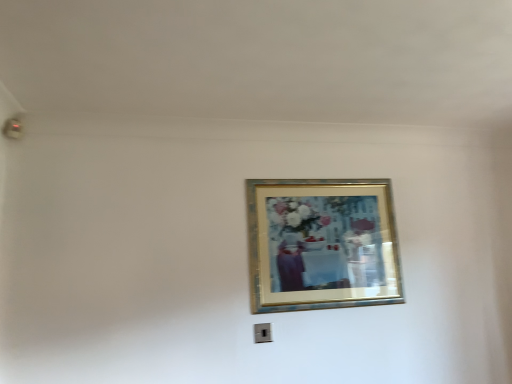
Find the location of a particular element. The height and width of the screenshot is (384, 512). black plastic electric outlet at lower center is located at coordinates click(262, 333).

In order to face black plastic electric outlet at lower center, should I rotate leftwards or rightwards?

To face it directly, rotate right by 1.275 degrees.

What do you see at coordinates (262, 333) in the screenshot? The width and height of the screenshot is (512, 384). I see `black plastic electric outlet at lower center` at bounding box center [262, 333].

Locate an element on the screen. The image size is (512, 384). gold metallic picture frame at upper center is located at coordinates (322, 244).

The width and height of the screenshot is (512, 384). What do you see at coordinates (322, 244) in the screenshot? I see `gold metallic picture frame at upper center` at bounding box center [322, 244].

Find the location of a particular element. black plastic electric outlet at lower center is located at coordinates (262, 333).

Considering the positions of objects gold metallic picture frame at upper center and black plastic electric outlet at lower center in the image provided, who is more to the right, gold metallic picture frame at upper center or black plastic electric outlet at lower center?

From the viewer's perspective, gold metallic picture frame at upper center appears more on the right side.

Does gold metallic picture frame at upper center lie behind black plastic electric outlet at lower center?

No.

Between point (384, 301) and point (269, 325), which one is positioned in front?

The point (269, 325) is closer.

From the image's perspective, which is below, gold metallic picture frame at upper center or black plastic electric outlet at lower center?

black plastic electric outlet at lower center, from the image's perspective.

Consider the image. From a real-world perspective, is gold metallic picture frame at upper center below black plastic electric outlet at lower center?

Actually, gold metallic picture frame at upper center is physically above black plastic electric outlet at lower center in the real world.

Does gold metallic picture frame at upper center have a lesser width compared to black plastic electric outlet at lower center?

No, gold metallic picture frame at upper center is not thinner than black plastic electric outlet at lower center.

Considering the relative sizes of gold metallic picture frame at upper center and black plastic electric outlet at lower center in the image provided, is gold metallic picture frame at upper center shorter than black plastic electric outlet at lower center?

No, gold metallic picture frame at upper center is not shorter than black plastic electric outlet at lower center.

Based on the photo, is gold metallic picture frame at upper center bigger than black plastic electric outlet at lower center?

Correct, gold metallic picture frame at upper center is larger in size than black plastic electric outlet at lower center.

Choose the correct answer: Is gold metallic picture frame at upper center inside black plastic electric outlet at lower center or outside it?

The correct answer is: outside.

In the scene shown: Is gold metallic picture frame at upper center in contact with black plastic electric outlet at lower center?

No, gold metallic picture frame at upper center is not making contact with black plastic electric outlet at lower center.

Could you tell me if gold metallic picture frame at upper center is facing black plastic electric outlet at lower center?

No.

Can you tell me how much gold metallic picture frame at upper center and black plastic electric outlet at lower center differ in facing direction?

They differ by 0.706 degrees in their facing directions.

How much distance is there between gold metallic picture frame at upper center and black plastic electric outlet at lower center?

20.56 inches.

Locate an element on the screen. The width and height of the screenshot is (512, 384). picture frame in front of the black plastic electric outlet at lower center is located at coordinates (322, 244).

Is black plastic electric outlet at lower center to the left or to the right of gold metallic picture frame at upper center in the image?

From the image, it's evident that black plastic electric outlet at lower center is to the left of gold metallic picture frame at upper center.

Is black plastic electric outlet at lower center in front of or behind gold metallic picture frame at upper center in the image?

black plastic electric outlet at lower center is positioned farther from the viewer than gold metallic picture frame at upper center.

Which point is more distant from viewer, (262, 327) or (387, 280)?

Point (387, 280)

From the picture: From the image's perspective, which object appears higher, black plastic electric outlet at lower center or gold metallic picture frame at upper center?

gold metallic picture frame at upper center appears higher in the image.

From a real-world perspective, which is physically below, black plastic electric outlet at lower center or gold metallic picture frame at upper center?

black plastic electric outlet at lower center is physically lower.

Does black plastic electric outlet at lower center have a greater width compared to gold metallic picture frame at upper center?

No, black plastic electric outlet at lower center is not wider than gold metallic picture frame at upper center.

Does black plastic electric outlet at lower center have a lesser height compared to gold metallic picture frame at upper center?

Yes, black plastic electric outlet at lower center is shorter than gold metallic picture frame at upper center.

Considering the sizes of objects black plastic electric outlet at lower center and gold metallic picture frame at upper center in the image provided, who is smaller, black plastic electric outlet at lower center or gold metallic picture frame at upper center?

black plastic electric outlet at lower center is smaller.

Is black plastic electric outlet at lower center surrounding gold metallic picture frame at upper center?

No, gold metallic picture frame at upper center is not surrounded by black plastic electric outlet at lower center.

Is black plastic electric outlet at lower center positioned far away from gold metallic picture frame at upper center?

No, there isn't a large distance between black plastic electric outlet at lower center and gold metallic picture frame at upper center.

Based on the photo, is black plastic electric outlet at lower center oriented towards gold metallic picture frame at upper center?

No, black plastic electric outlet at lower center is not turned towards gold metallic picture frame at upper center.

What's the angular difference between black plastic electric outlet at lower center and gold metallic picture frame at upper center's facing directions?

black plastic electric outlet at lower center and gold metallic picture frame at upper center are facing 0.706 degrees away from each other.

This screenshot has height=384, width=512. In order to click on picture frame that is in front of the black plastic electric outlet at lower center in this screenshot , I will do `click(322, 244)`.

At what (x,y) coordinates should I click in order to perform the action: click on picture frame above the black plastic electric outlet at lower center (from the image's perspective). Please return your answer as a coordinate pair (x, y). Looking at the image, I should click on (322, 244).

There is a black plastic electric outlet at lower center. Where is `picture frame above it (from a real-world perspective)`? picture frame above it (from a real-world perspective) is located at coordinates (322, 244).